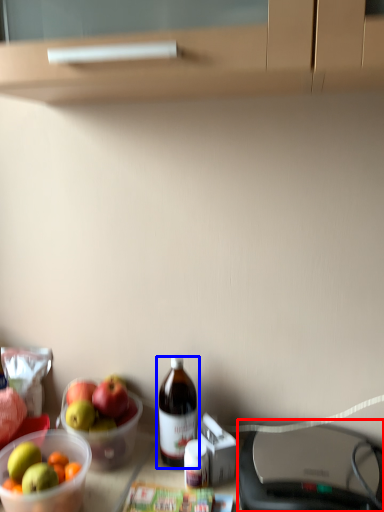
Question: Which object appears closest to the camera in this image, wide (highlighted by a red box) or bottle (highlighted by a blue box)?

Choices:
 (A) wide
 (B) bottle

Answer: (A)